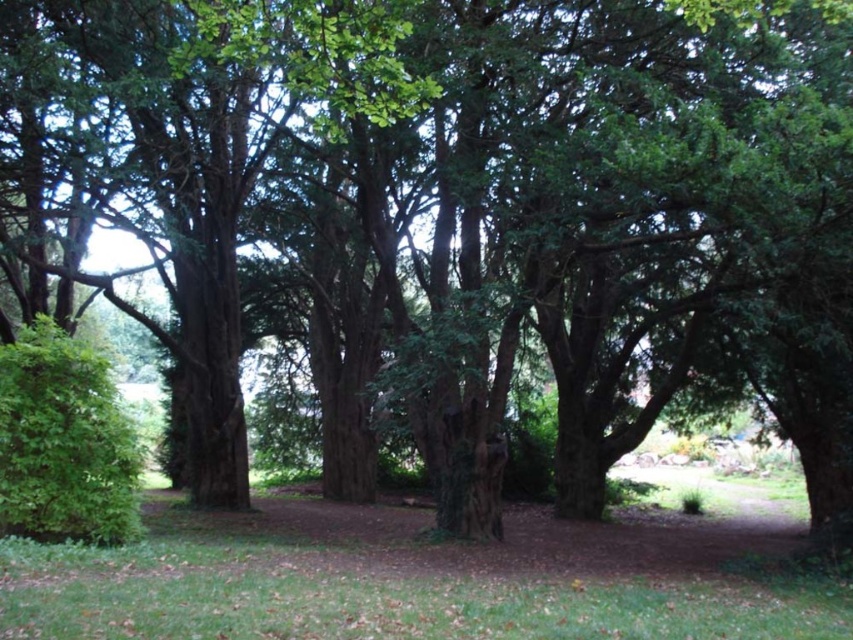
Question: Among these points, which one is farthest from the camera?

Choices:
 (A) (26, 518)
 (B) (219, 604)

Answer: (A)

Question: Which point is closer to the camera?

Choices:
 (A) (332, 621)
 (B) (30, 490)

Answer: (A)

Question: Does green grass at center come in front of green leafy hedge at lower left?

Choices:
 (A) no
 (B) yes

Answer: (B)

Question: Can you confirm if green grass at center is positioned to the right of green leafy hedge at lower left?

Choices:
 (A) no
 (B) yes

Answer: (B)

Question: Is green grass at center in front of green leafy hedge at lower left?

Choices:
 (A) yes
 (B) no

Answer: (A)